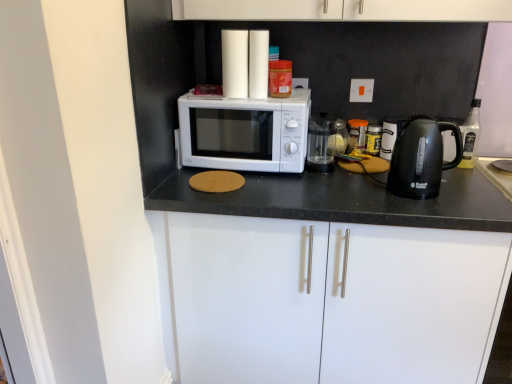
Locate an element on the screen. This screenshot has height=384, width=512. free space in front of white matte microwave at center is located at coordinates (276, 193).